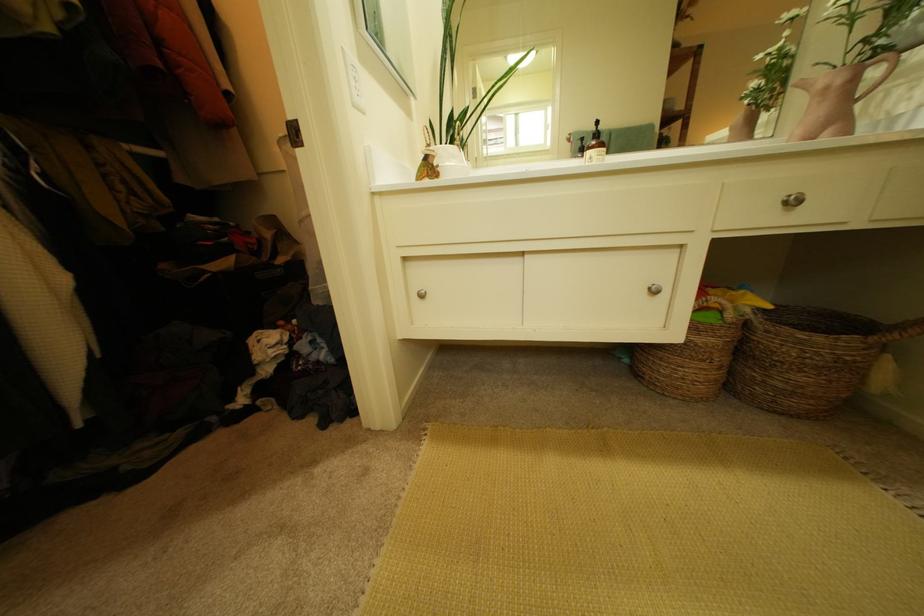
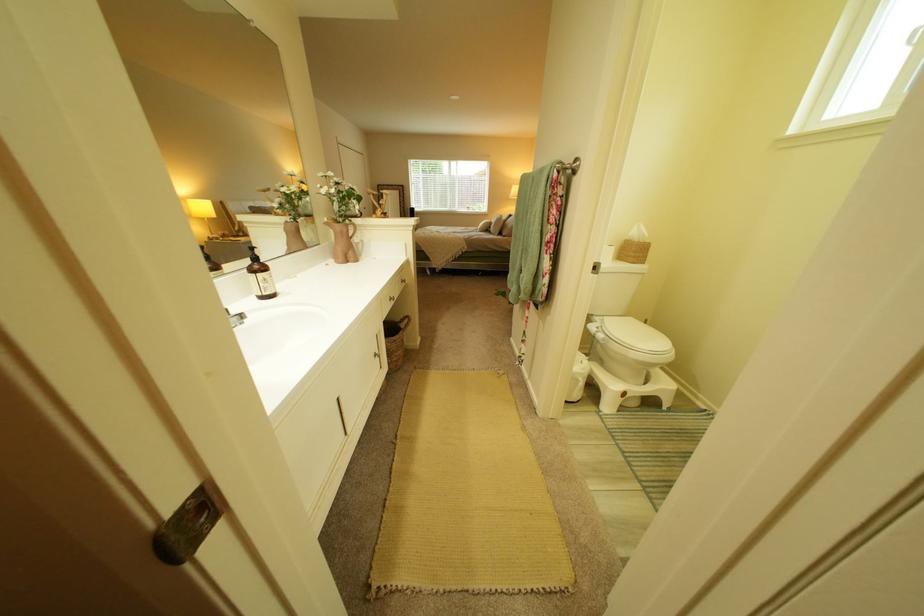
In the second image, find the point that corresponds to pixel 819 86 in the first image.

(342, 225)